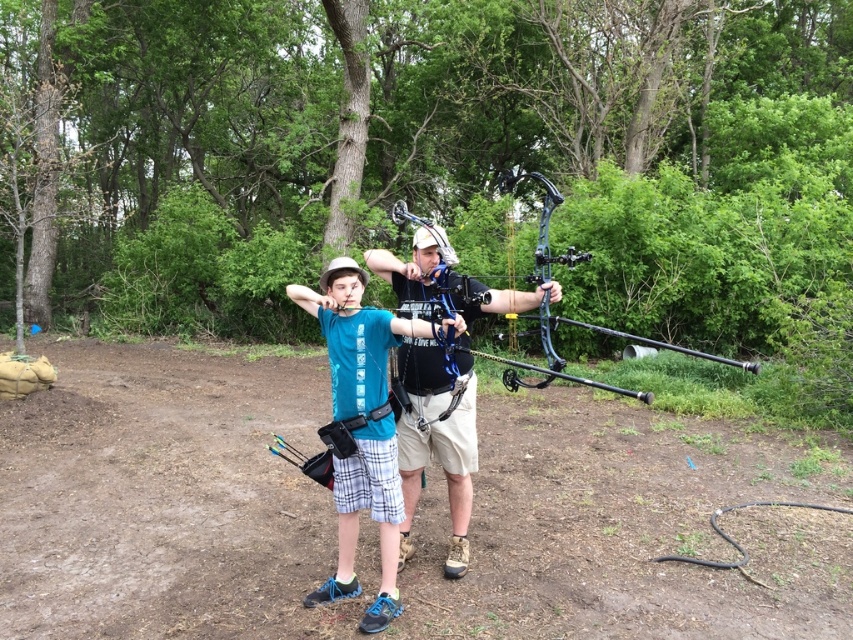
Is blue fabric shirt at center to the left of matte black bow at center from the viewer's perspective?

Correct, you'll find blue fabric shirt at center to the left of matte black bow at center.

Who is lower down, blue fabric shirt at center or matte black bow at center?

blue fabric shirt at center is lower down.

Where is `blue fabric shirt at center`? blue fabric shirt at center is located at coordinates (361, 426).

Can you confirm if matte black bow at center is thinner than shiny black bow at center?

Yes.

From the picture: Can you confirm if matte black bow at center is shorter than shiny black bow at center?

Correct, matte black bow at center is not as tall as shiny black bow at center.

Find the location of a particular element. The width and height of the screenshot is (853, 640). matte black bow at center is located at coordinates (442, 467).

Between blue fabric shirt at center and matte black fishing pole at center, which one has less height?

matte black fishing pole at center

Is the position of blue fabric shirt at center more distant than that of matte black fishing pole at center?

Yes, it is.

Is point (397, 557) in front of point (521, 364)?

No, it is not.

Where is `blue fabric shirt at center`? The image size is (853, 640). blue fabric shirt at center is located at coordinates point(361,426).